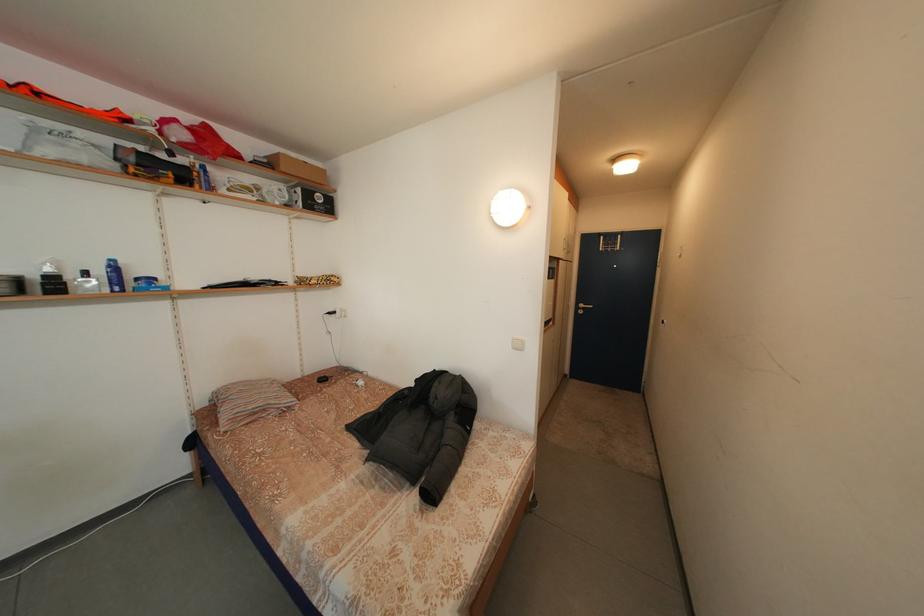
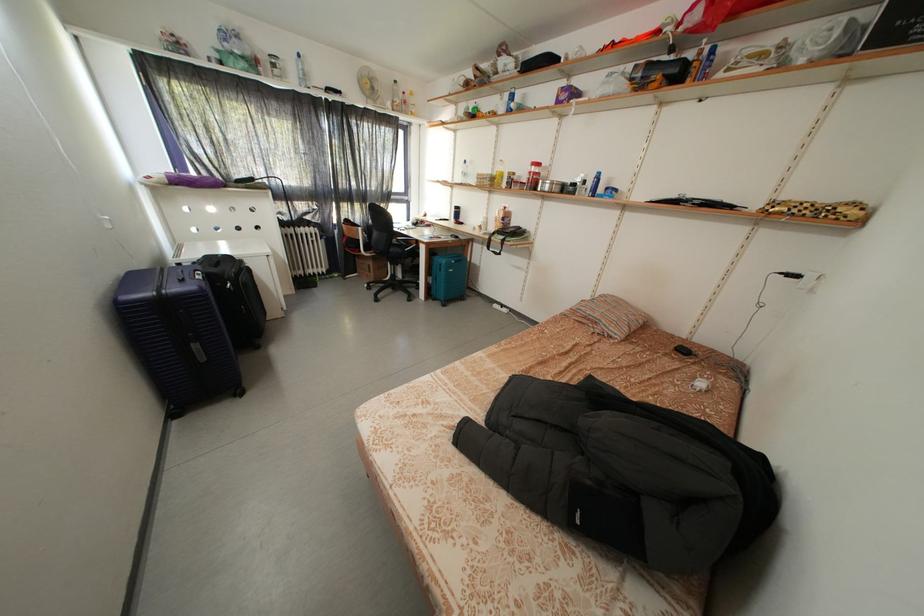
Where in the second image is the point corresponding to point (331, 384) from the first image?

(691, 355)